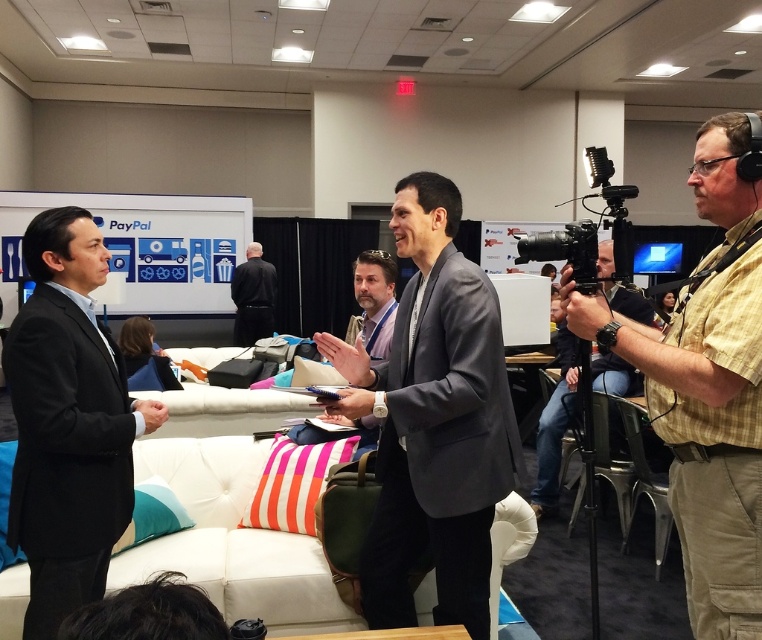
Question: In this image, where is black suit at left located relative to black fabric shirt at center?

Choices:
 (A) left
 (B) right

Answer: (B)

Question: Which object is positioned closest to the black suit at left?

Choices:
 (A) black fabric shirt at center
 (B) gray suit at center
 (C) yellow plaid shirt at right

Answer: (B)

Question: Does yellow plaid shirt at right have a lesser width compared to matte black camera at right?

Choices:
 (A) no
 (B) yes

Answer: (B)

Question: Which object is the farthest from the gray suit at center?

Choices:
 (A) yellow plaid shirt at right
 (B) black fabric shirt at center

Answer: (B)

Question: Among these objects, which one is nearest to the camera?

Choices:
 (A) gray fabric suit at center
 (B) gray suit at center

Answer: (A)

Question: Does gray fabric suit at center have a larger size compared to matte black camera at right?

Choices:
 (A) yes
 (B) no

Answer: (B)